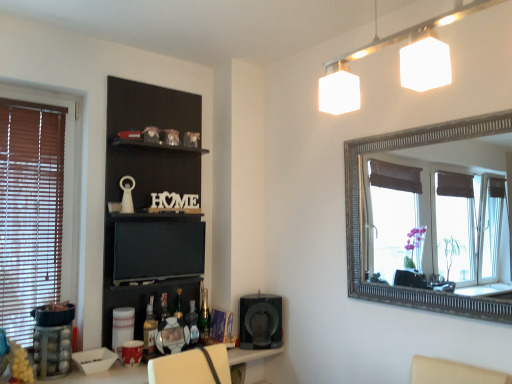
What is the approximate height of white glossy table at lower center?

13.68 inches.

Measure the distance between white glossy table at lower center and camera.

white glossy table at lower center and camera are 5.78 feet apart from each other.

Locate an element on the screen. The width and height of the screenshot is (512, 384). metallic silver picture frame at center is located at coordinates pos(172,336).

How much space does translucent glass bottle at lower center, the first bottle when ordered from front to back, occupy horizontally?

translucent glass bottle at lower center, the first bottle when ordered from front to back, is 2.99 inches wide.

What do you see at coordinates (260, 321) in the screenshot? I see `black matte speaker at lower center` at bounding box center [260, 321].

Locate an element on the screen. The image size is (512, 384). matte black tv at center is located at coordinates (158, 249).

Relative to translucent glass bottle at lower center, the first bottle when ordered from front to back, is translucent plastic bottle at lower center, which appears as the 2th bottle when viewed from the front, in front or behind?

translucent plastic bottle at lower center, which appears as the 2th bottle when viewed from the front, is behind translucent glass bottle at lower center, the first bottle when ordered from front to back.

Is translucent plastic bottle at lower center, marked as the second bottle in a right-to-left arrangement, not within translucent glass bottle at lower center, the third bottle positioned from the right?

Yes, translucent plastic bottle at lower center, marked as the second bottle in a right-to-left arrangement, is located beyond the bounds of translucent glass bottle at lower center, the third bottle positioned from the right.

How far apart are translucent plastic bottle at lower center, which ranks as the second bottle in back-to-front order, and translucent glass bottle at lower center, positioned as the 1th bottle in left-to-right order?

They are 9.71 inches apart.

Does metallic silver picture frame at center have a larger size compared to white glossy table at lower center?

No.

Between point (157, 341) and point (68, 382), which one is positioned in front?

The point (68, 382) is in front.

From a real-world perspective, which is physically below, metallic silver picture frame at center or white glossy table at lower center?

From a 3D spatial view, white glossy table at lower center is below.

Is metallic silver picture frame at center surrounding white glossy table at lower center?

No, white glossy table at lower center is not inside metallic silver picture frame at center.

From a real-world perspective, relative to black matte speaker at lower center, is metallic silver picture frame at center vertically above or below?

metallic silver picture frame at center is situated lower than black matte speaker at lower center in the real world.

Does metallic silver picture frame at center have a larger size compared to black matte speaker at lower center?

No.

Could you tell me if metallic silver picture frame at center is facing black matte speaker at lower center?

No.

In the scene shown: Is metallic silver picture frame at center to the left of black matte speaker at lower center from the viewer's perspective?

Correct, you'll find metallic silver picture frame at center to the left of black matte speaker at lower center.

Is matte black tv at center closer to camera compared to green glass bottle at lower center, which is the 1th bottle from back to front?

Yes.

Considering the positions of point (172, 261) and point (205, 304), is point (172, 261) closer or farther from the camera than point (205, 304)?

Point (172, 261) is positioned closer to the camera compared to point (205, 304).

From the image's perspective, who appears lower, matte black tv at center or green glass bottle at lower center, the 1th bottle from the right?

green glass bottle at lower center, the 1th bottle from the right, is shown below in the image.

Considering the sizes of objects matte black tv at center and green glass bottle at lower center, the 3th bottle from the left, in the image provided, who is wider, matte black tv at center or green glass bottle at lower center, the 3th bottle from the left,?

green glass bottle at lower center, the 3th bottle from the left, is wider.

From a real-world perspective, which object rests below the other?

white glossy table at lower center, from a real-world perspective.

Is white glossy table at lower center thinner than matte black tv at center?

No.

From the image's perspective, is white glossy table at lower center below matte black tv at center?

Yes.

Does black matte shelf at upper center come in front of black matte speaker at lower center?

Yes, black matte shelf at upper center is closer to the camera.

Looking at their sizes, would you say black matte shelf at upper center is wider or thinner than black matte speaker at lower center?

Clearly, black matte shelf at upper center has less width compared to black matte speaker at lower center.

Is black matte speaker at lower center completely or partially inside black matte shelf at upper center?

No, black matte speaker at lower center is not surrounded by black matte shelf at upper center.

Based on the photo, which is less distant, [136,338] or [249,308]?

Point [136,338]

Is green glass bottle at lower center, the 3th bottle from the left, aimed at translucent plastic bottle at lower center, which ranks as the second bottle in back-to-front order?

No, green glass bottle at lower center, the 3th bottle from the left, does not turn towards translucent plastic bottle at lower center, which ranks as the second bottle in back-to-front order.

Measure the distance from green glass bottle at lower center, the 1th bottle from the right, to translucent plastic bottle at lower center, marked as the second bottle in a right-to-left arrangement.

green glass bottle at lower center, the 1th bottle from the right, and translucent plastic bottle at lower center, marked as the second bottle in a right-to-left arrangement, are 2.12 inches apart.

Does green glass bottle at lower center, which is the third bottle from front to back, lie behind translucent plastic bottle at lower center, marked as the second bottle in a right-to-left arrangement?

Yes.

Looking at this image, between green glass bottle at lower center, the 3th bottle from the left, and translucent plastic bottle at lower center, the second bottle viewed from the left, which one appears on the right side from the viewer's perspective?

From the viewer's perspective, green glass bottle at lower center, the 3th bottle from the left, appears more on the right side.

Find the location of a particular element. bottle located underneath the translucent plastic bottle at lower center, which ranks as the second bottle in back-to-front order (from a real-world perspective) is located at coordinates (149, 332).

Where is `picture frame above the white glossy table at lower center (from a real-world perspective)`? This screenshot has height=384, width=512. picture frame above the white glossy table at lower center (from a real-world perspective) is located at coordinates tap(172, 336).

Looking at the image, which one is located further to white glossy table at lower center, translucent glass bottle at lower center, positioned as the 1th bottle in left-to-right order, or matte black tv at center?

Among the two, matte black tv at center is located further to white glossy table at lower center.

Based on their spatial positions, is black matte shelf at upper center or matte black tv at center further from white glossy table at lower center?

black matte shelf at upper center lies further to white glossy table at lower center than the other object.

Estimate the real-world distances between objects in this image. Which object is further from green glass bottle at lower center, the 3th bottle from the left, white glossy table at lower center or black matte shelf at upper center?

The object further to green glass bottle at lower center, the 3th bottle from the left, is black matte shelf at upper center.

Based on their spatial positions, is black matte speaker at lower center or white glossy table at lower center further from black matte shelf at upper center?

white glossy table at lower center.

Looking at the image, which one is located closer to matte black tv at center, white glossy table at lower center or black matte speaker at lower center?

The object closer to matte black tv at center is black matte speaker at lower center.

Which object lies further to the anchor point translucent plastic bottle at lower center, the second bottle viewed from the left, matte black tv at center or green glass bottle at lower center, which is the 1th bottle from back to front?

The object further to translucent plastic bottle at lower center, the second bottle viewed from the left, is matte black tv at center.

Looking at this image, based on their spatial positions, is metallic silver picture frame at center or translucent plastic bottle at lower center, the second bottle viewed from the left, closer to black matte shelf at upper center?

metallic silver picture frame at center is positioned closer to the anchor black matte shelf at upper center.

When comparing their distances from black matte speaker at lower center, does white glossy table at lower center or black matte shelf at upper center seem further?

black matte shelf at upper center lies further to black matte speaker at lower center than the other object.

At what (x,y) coordinates should I click in order to perform the action: click on speaker between matte black tv at center and white glossy table at lower center vertically. Please return your answer as a coordinate pair (x, y). Looking at the image, I should click on (260, 321).

At what (x,y) coordinates should I click in order to perform the action: click on speaker that lies between black matte shelf at upper center and metallic silver picture frame at center from top to bottom. Please return your answer as a coordinate pair (x, y). This screenshot has width=512, height=384. Looking at the image, I should click on (260, 321).

This screenshot has width=512, height=384. I want to click on table located between translucent glass bottle at lower center, acting as the 3th bottle starting from the back, and black matte speaker at lower center in the left-right direction, so click(105, 375).

In order to click on bottle that lies between black matte shelf at upper center and translucent glass bottle at lower center, positioned as the 1th bottle in left-to-right order, from top to bottom in this screenshot , I will do [x=204, y=317].